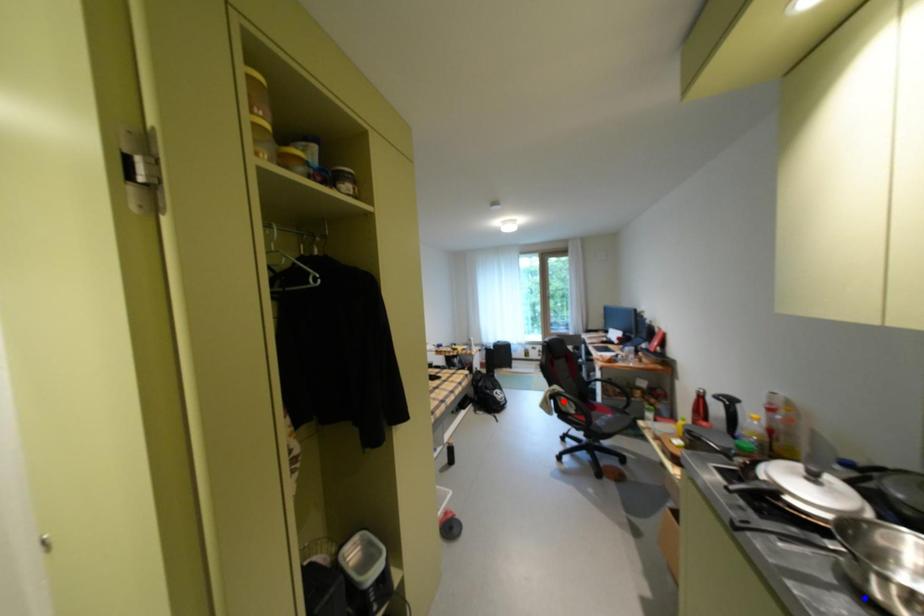
Question: Which of the two points in the image is closer to the camera?

Choices:
 (A) Blue point is closer.
 (B) Red point is closer.

Answer: (A)